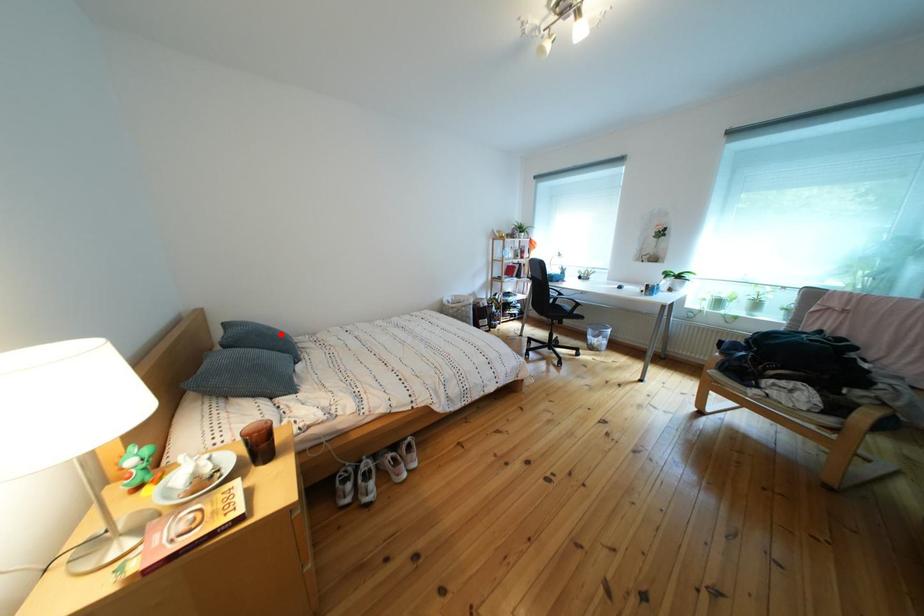
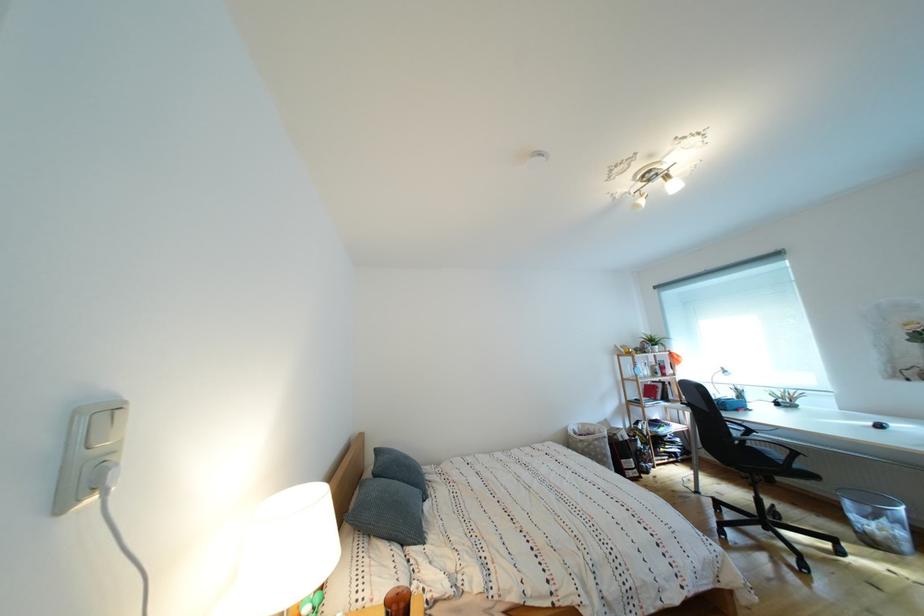
The point at the highlighted location is marked in the first image. Where is the corresponding point in the second image?

(418, 463)